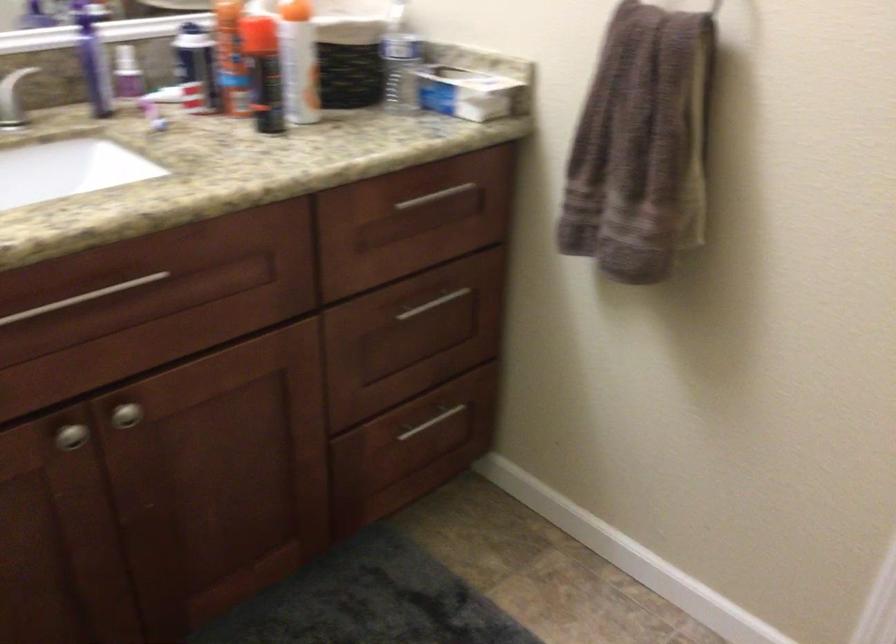
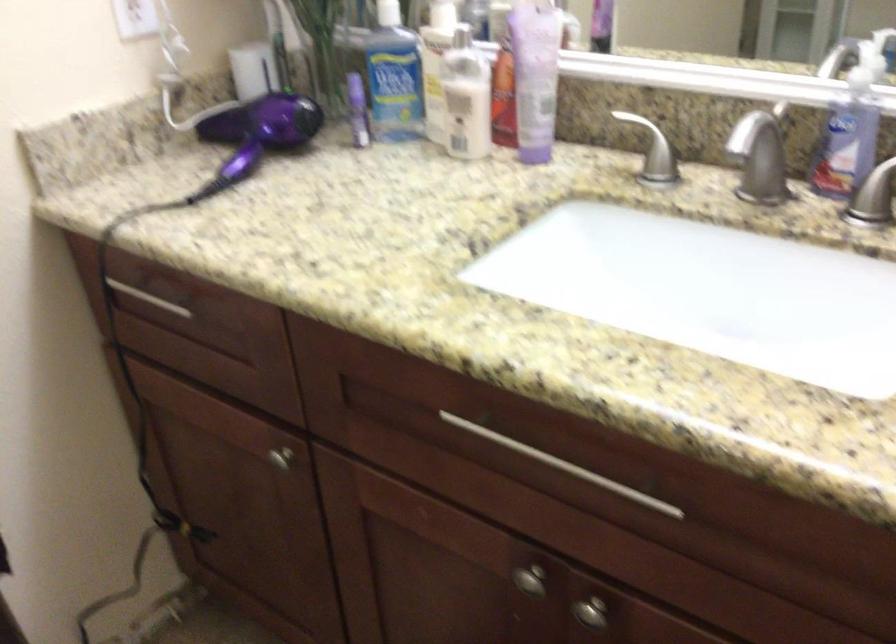
In the second image, find the point that corresponds to the point at 135,411 in the first image.

(590, 612)